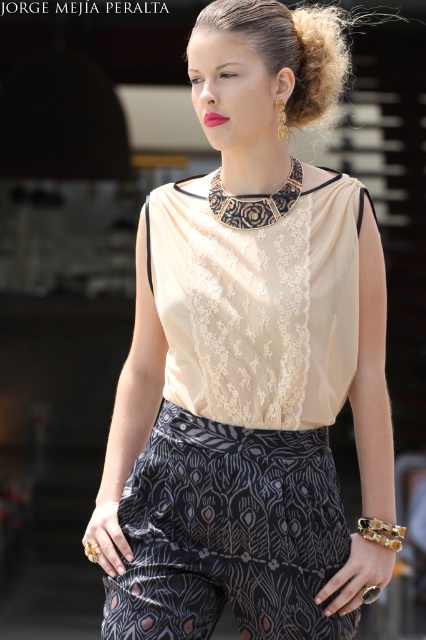
Can you confirm if beige satin blouse at center is positioned to the right of black lace neckband at center?

Incorrect, beige satin blouse at center is not on the right side of black lace neckband at center.

Is point (279, 420) positioned in front of point (213, 180)?

That is True.

You are a GUI agent. You are given a task and a screenshot of the screen. Output one action in this format:
    pyautogui.click(x=<x>, y=<y>)
    Task: Click on the beige satin blouse at center
    Image resolution: width=426 pixels, height=640 pixels.
    Given the screenshot: What is the action you would take?
    pyautogui.click(x=221, y=481)

Is beige satin blouse at center closer to the viewer compared to blonde hair at upper center?

Yes, it is in front of blonde hair at upper center.

Does point (351, 604) lie behind point (331, 92)?

No, it is not.

At what (x,y) coordinates should I click in order to perform the action: click on beige satin blouse at center. Please return your answer as a coordinate pair (x, y). Image resolution: width=426 pixels, height=640 pixels. Looking at the image, I should click on pos(221,481).

Find the location of a particular element. The height and width of the screenshot is (640, 426). beige satin blouse at center is located at coordinates (221, 481).

Is blonde hair at upper center wider than black lace neckband at center?

No, blonde hair at upper center is not wider than black lace neckband at center.

Where is `blonde hair at upper center`? blonde hair at upper center is located at coordinates (314, 60).